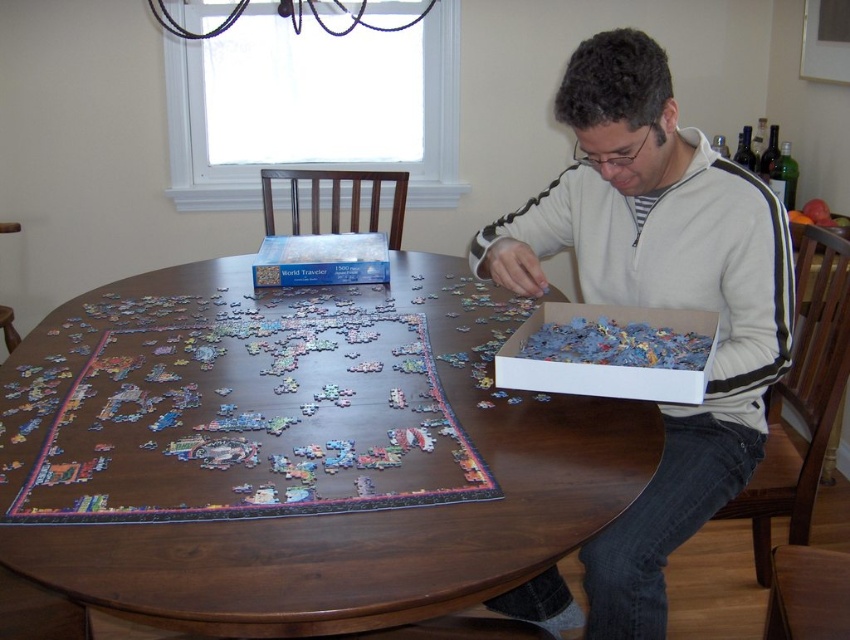
Is dark wood round table at center taller than multicolored paper puzzle at center?

Yes, dark wood round table at center is taller than multicolored paper puzzle at center.

Is dark wood round table at center closer to camera compared to multicolored paper puzzle at center?

Yes, it is.

Locate an element on the screen. Image resolution: width=850 pixels, height=640 pixels. dark wood round table at center is located at coordinates (295, 451).

The width and height of the screenshot is (850, 640). In order to click on dark wood round table at center in this screenshot , I will do `click(295, 451)`.

Is dark wood round table at center smaller than white cardboard box at lower right?

Incorrect, dark wood round table at center is not smaller in size than white cardboard box at lower right.

Find the location of `dark wood round table at center`. dark wood round table at center is located at coordinates (295, 451).

You are a GUI agent. You are given a task and a screenshot of the screen. Output one action in this format:
    pyautogui.click(x=<x>, y=<y>)
    Task: Click on the dark wood round table at center
    This screenshot has height=640, width=850.
    Given the screenshot: What is the action you would take?
    pyautogui.click(x=295, y=451)

Is white fleece sweater at center wider than white cardboard box at lower right?

Correct, the width of white fleece sweater at center exceeds that of white cardboard box at lower right.

Can you confirm if white fleece sweater at center is positioned to the left of white cardboard box at lower right?

Yes, white fleece sweater at center is to the left of white cardboard box at lower right.

Is point (707, 460) in front of point (653, 321)?

Yes.

This screenshot has width=850, height=640. Find the location of `white fleece sweater at center`. white fleece sweater at center is located at coordinates [658, 298].